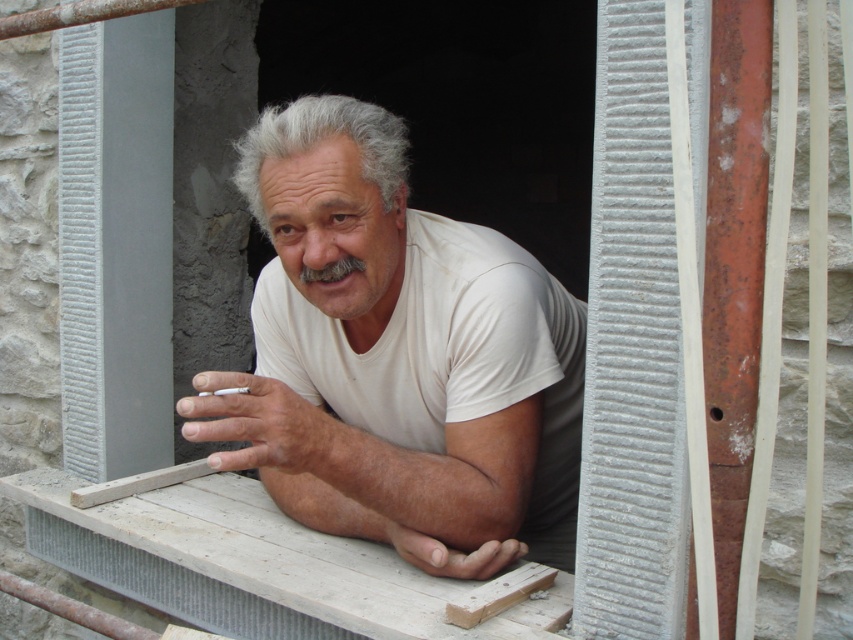
Question: Among these points, which one is nearest to the camera?

Choices:
 (A) (473, 276)
 (B) (583, 358)

Answer: (A)

Question: Which point is closer to the camera?

Choices:
 (A) (524, 280)
 (B) (329, 212)

Answer: (B)

Question: Can you confirm if white matte t-shirt at center is bigger than white cotton t-shirt at center?

Choices:
 (A) no
 (B) yes

Answer: (B)

Question: Is white matte t-shirt at center to the right of white cotton t-shirt at center from the viewer's perspective?

Choices:
 (A) yes
 (B) no

Answer: (B)

Question: Is white matte t-shirt at center to the right of white cotton t-shirt at center from the viewer's perspective?

Choices:
 (A) no
 (B) yes

Answer: (A)